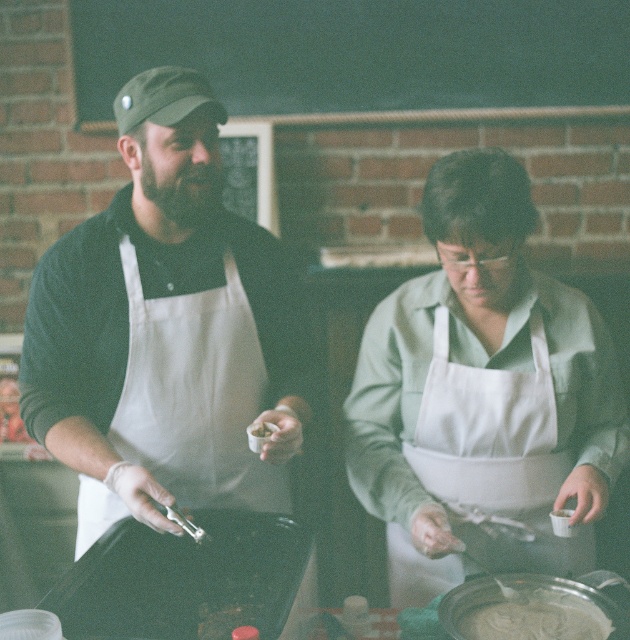
You are a food safety inspector checking the kitchen. You notice the white matte apron at center and the white creamy batter at lower center. Which item is bigger in size?

The white matte apron at center is larger in size compared to the white creamy batter at lower center.

You are a food inspector observing the scene. You need to check if the white creamy batter at lower center is within reach of the white matte apron at center. Can you confirm if the batter is positioned to the left or right side of the apron?

The white creamy batter at lower center is to the right of the white matte apron at center.